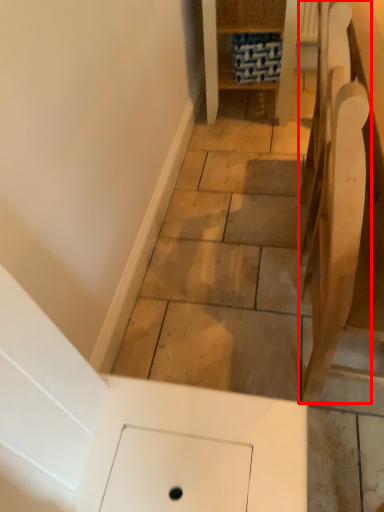
Question: From the image's perspective, where is furniture (annotated by the red box) located relative to furniture?

Choices:
 (A) below
 (B) above

Answer: (A)